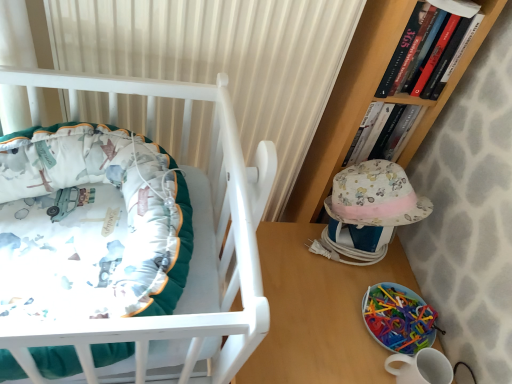
Question: Is hardcover book at upper right, which is the first book in front-to-back order, oriented towards wooden table at lower right?

Choices:
 (A) yes
 (B) no

Answer: (B)

Question: From the image's perspective, is hardcover book at upper right, placed as the second book when sorted from back to front, over wooden table at lower right?

Choices:
 (A) yes
 (B) no

Answer: (A)

Question: Is hardcover book at upper right, which is the first book in front-to-back order, positioned in front of wooden table at lower right?

Choices:
 (A) yes
 (B) no

Answer: (A)

Question: Is hardcover book at upper right, which is the first book in front-to-back order, bigger than wooden table at lower right?

Choices:
 (A) yes
 (B) no

Answer: (B)

Question: Can you confirm if hardcover book at upper right, which is the first book in front-to-back order, is shorter than wooden table at lower right?

Choices:
 (A) no
 (B) yes

Answer: (B)

Question: From a real-world perspective, is hardcover book at upper right, placed as the second book when sorted from back to front, on wooden table at lower right?

Choices:
 (A) yes
 (B) no

Answer: (A)

Question: Is hardcover book at upper right, placed as the second book when sorted from back to front, positioned behind matte white crib at left?

Choices:
 (A) no
 (B) yes

Answer: (B)

Question: Considering the relative sizes of hardcover book at upper right, which is the first book in front-to-back order, and matte white crib at left in the image provided, is hardcover book at upper right, which is the first book in front-to-back order, taller than matte white crib at left?

Choices:
 (A) no
 (B) yes

Answer: (A)

Question: Is hardcover book at upper right, placed as the second book when sorted from back to front, looking in the opposite direction of matte white crib at left?

Choices:
 (A) yes
 (B) no

Answer: (B)

Question: From the image's perspective, does hardcover book at upper right, placed as the second book when sorted from back to front, appear higher than matte white crib at left?

Choices:
 (A) yes
 (B) no

Answer: (A)

Question: Does hardcover book at upper right, placed as the second book when sorted from back to front, have a lesser height compared to matte white crib at left?

Choices:
 (A) yes
 (B) no

Answer: (A)

Question: Is hardcover book at upper right, which is the first book in front-to-back order, to the right of matte white crib at left from the viewer's perspective?

Choices:
 (A) no
 (B) yes

Answer: (B)

Question: Is translucent plastic toy at lower right further to the viewer compared to wooden table at lower right?

Choices:
 (A) yes
 (B) no

Answer: (A)